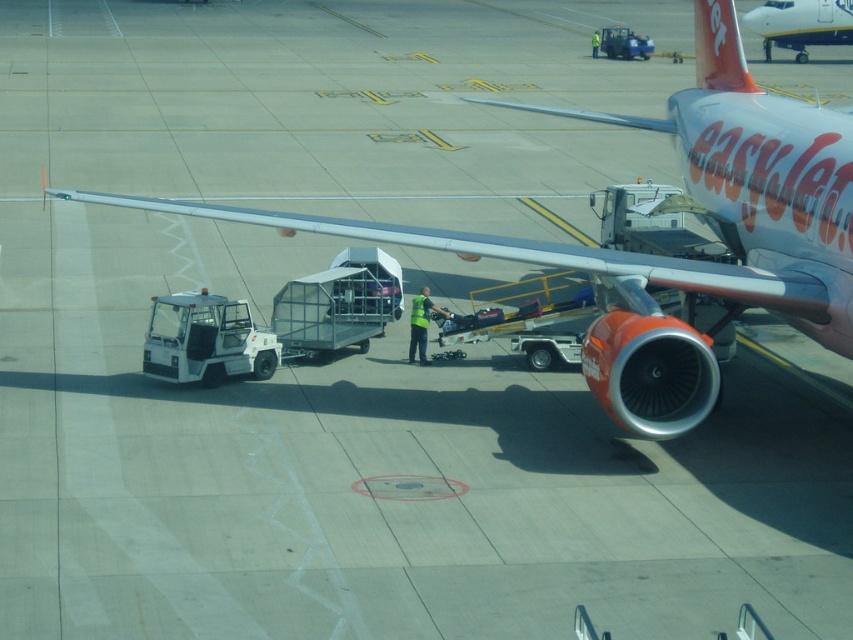
Looking at this image, is white glossy airplane at upper right shorter than green reflective vest at center?

Incorrect, white glossy airplane at upper right's height does not fall short of green reflective vest at center's.

At what (x,y) coordinates should I click in order to perform the action: click on white glossy airplane at upper right. Please return your answer as a coordinate pair (x, y). The image size is (853, 640). Looking at the image, I should click on (799, 24).

Based on the photo, can you confirm if metallic silver airplane at center is bigger than white glossy airplane at upper right?

Indeed, metallic silver airplane at center has a larger size compared to white glossy airplane at upper right.

Is metallic silver airplane at center below white glossy airplane at upper right?

Correct, metallic silver airplane at center is located below white glossy airplane at upper right.

Identify the location of metallic silver airplane at center. Image resolution: width=853 pixels, height=640 pixels. (669, 257).

Can you confirm if metallic silver airplane at center is taller than green reflective vest at center?

Yes, metallic silver airplane at center is taller than green reflective vest at center.

Does metallic silver airplane at center come in front of green reflective vest at center?

Yes.

What do you see at coordinates (669, 257) in the screenshot?
I see `metallic silver airplane at center` at bounding box center [669, 257].

Where is `metallic silver airplane at center`? This screenshot has height=640, width=853. metallic silver airplane at center is located at coordinates (669, 257).